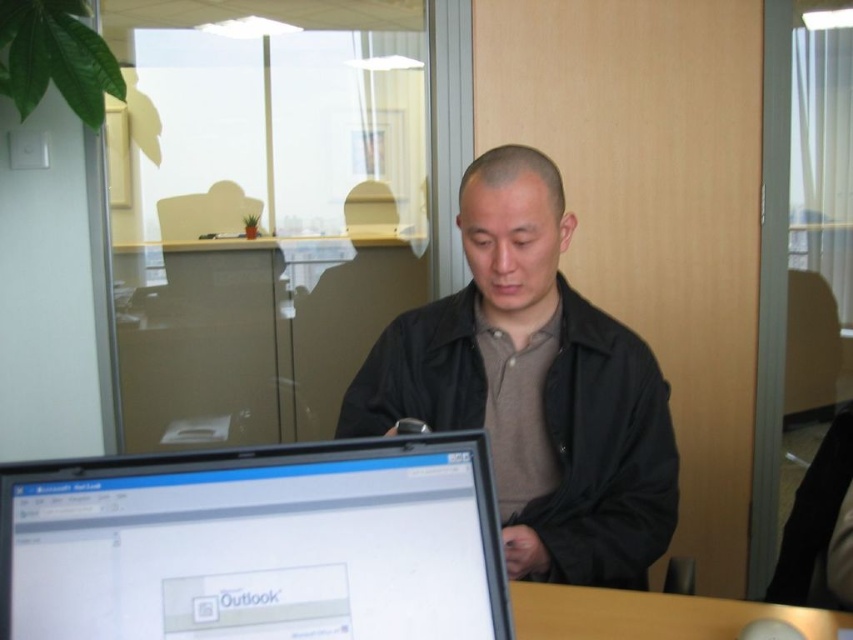
You are a delivery person who just arrived at an office. You need to place a matte black laptop at lower left on a desk that is 32 inches away from you. Can you fit the laptop on the desk without moving any other items?

The matte black laptop at lower left is currently 30.76 inches away from the viewer. Since the desk is 32 inches away, the distance is sufficient to place the laptop there without needing to move other items.

You are organizing the desk in the office scene. You need to move the matte black laptop at lower left to make space for a new monitor. Since the laptop is in front of the brown wooden table at lower center, where should you move it to ensure it doesn t block the table?

Result: Since the matte black laptop at lower left is currently in front of the brown wooden table at lower center, moving it to the side or behind the table would prevent it from blocking the table.

You are an interior designer planning to place a new rectangular desk that is 1.2 meters wide in this office. The desk must be placed where the brown wooden table at lower center is currently located. Based on the scene, will the black matte jacket at center fit comfortably next to the new desk without overcrowding the space?

The black matte jacket at center has a larger width than the brown wooden table at lower center. Since the new desk is wider than the current table, placing it might reduce the available space next to the black matte jacket at center, potentially causing overcrowding. Therefore, the jacket might not fit comfortably next to the new desk.